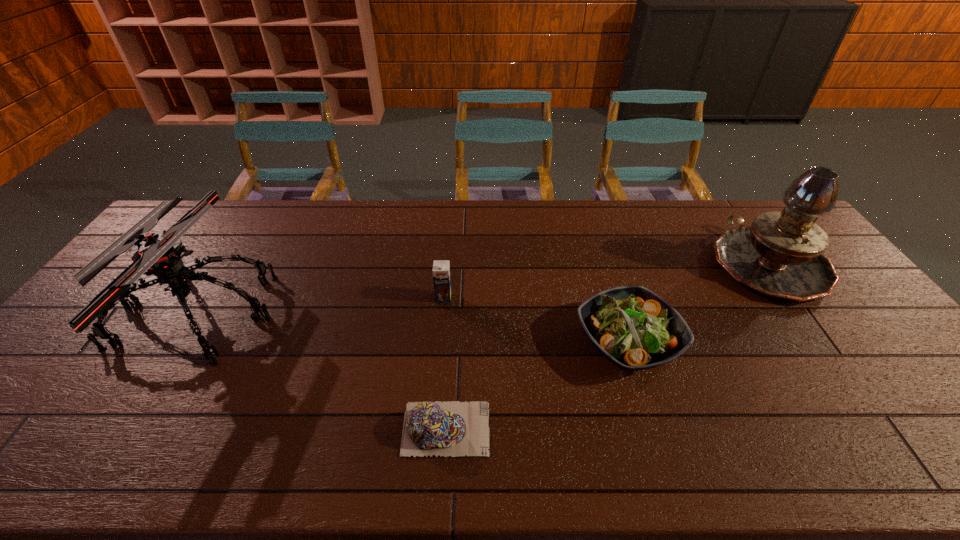
At what (x,y) coordinates should I click in order to perform the action: click on vacant position located on the right of the fourth shortest object. Please return your answer as a coordinate pair (x, y). Looking at the image, I should click on (393, 311).

The image size is (960, 540). I want to click on free space located on the front label of the third shortest object, so click(x=438, y=365).

Locate an element on the screen. This screenshot has width=960, height=540. vacant space located on the back of the salad plate is located at coordinates (609, 281).

Image resolution: width=960 pixels, height=540 pixels. Find the location of `vacant space located on the front, side, and top of the cap`. vacant space located on the front, side, and top of the cap is located at coordinates (547, 428).

At what (x,y) coordinates should I click in order to perform the action: click on object that is at the far edge. Please return your answer as a coordinate pair (x, y). Image resolution: width=960 pixels, height=540 pixels. Looking at the image, I should click on (780, 255).

At what (x,y) coordinates should I click in order to perform the action: click on object present at the near edge. Please return your answer as a coordinate pair (x, y). Looking at the image, I should click on (453, 428).

Identify the location of object at the left edge. The height and width of the screenshot is (540, 960). (159, 255).

At what (x,y) coordinates should I click in order to perform the action: click on object present at the right edge. Please return your answer as a coordinate pair (x, y). Looking at the image, I should click on (780, 255).

Find the location of a particular element. object present at the far right corner is located at coordinates (780, 255).

Where is `vacant space at the far edge`? This screenshot has height=540, width=960. vacant space at the far edge is located at coordinates (291, 230).